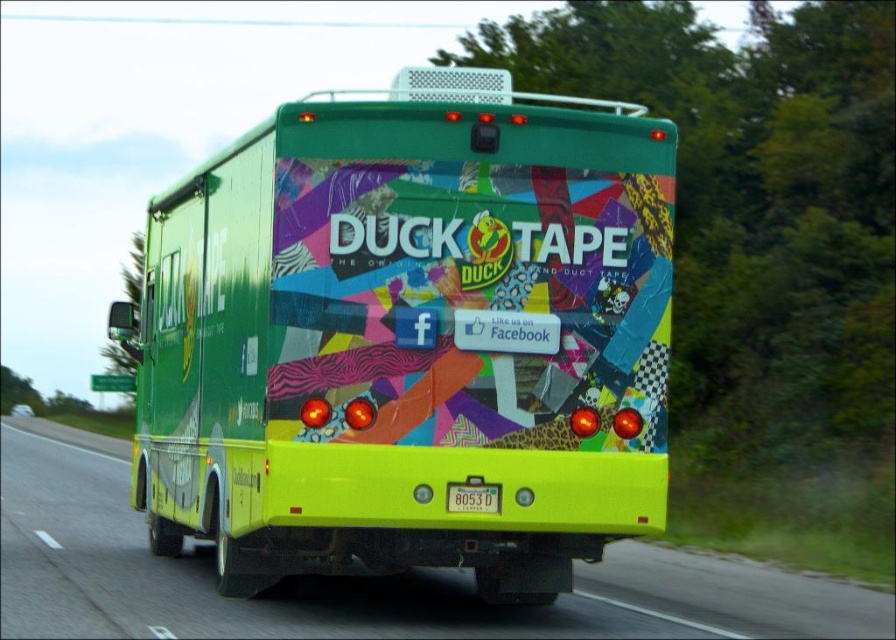
You are a pedestrian standing on the sidewalk and see two buses ahead of you, a green matte bus at center and a yellow glossy bus at center. Which one is closer to you?

The green matte bus at center is closer to you since it is in front of the yellow glossy bus at center.

You are standing on the sidewalk and see the vibrant green truck with the Duck Tape advertisement. There is also a yellow glossy bus at center. Based on their positions, which vehicle is closer to you?

The yellow glossy bus at center is closer to you because it is located at point (399, 577) which is closer to the observer compared to the green truck.

You are a pedestrian standing at the origin point of the coordinate system. You see a green matte bus at center represented by point (409, 337). Is the bus closer to the origin point than the coordinate point 0.5, 0.5?

The green matte bus at center is represented by point (409, 337). The distance between this point and the origin point is sqrt0.528 squared plus 0.458 squared, which is approximately 0.702. The distance between the origin point and 0.5, 0.5 is sqrt0.5 squared plus 0.5 squared, which is approximately 0.707. Since 0.702 is less than 0.707, the bus is closer to the origin point than the coordinate point 0.5, 0.5.